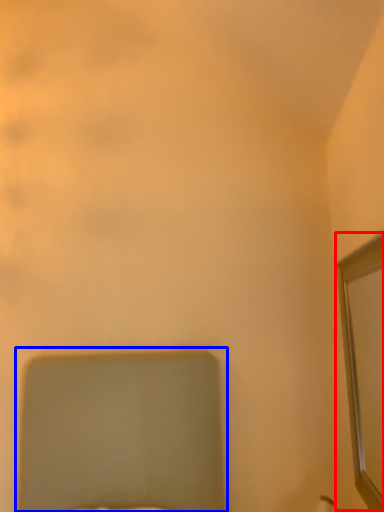
Question: Which object is further to the camera taking this photo, mirror (highlighted by a red box) or bed (highlighted by a blue box)?

Choices:
 (A) mirror
 (B) bed

Answer: (A)